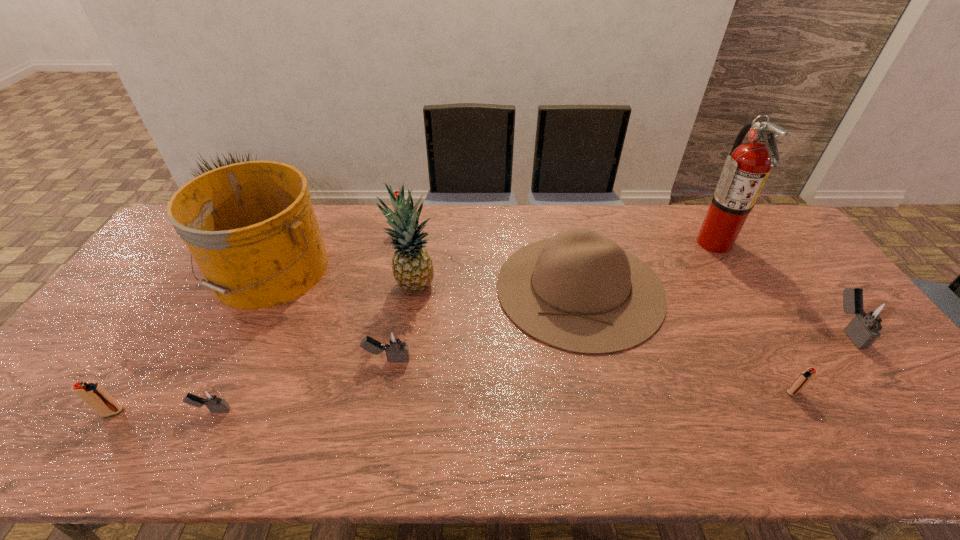
Where is `vacant space at the far right corner of the desktop`? vacant space at the far right corner of the desktop is located at coordinates (758, 217).

Identify the location of free space between the pineapple and the bucket. Image resolution: width=960 pixels, height=540 pixels. (341, 278).

The image size is (960, 540). In order to click on vacant space that's between the leftmost gray igniter and the fourth farthest igniter in this screenshot , I will do tap(502, 401).

At what (x,y) coordinates should I click in order to perform the action: click on free space between the rightmost gray igniter and the nearest red igniter. Please return your answer as a coordinate pair (x, y). This screenshot has width=960, height=540. Looking at the image, I should click on (480, 370).

Find the location of a particular element. This screenshot has height=540, width=960. empty space between the smallest gray igniter and the pineapple is located at coordinates (313, 348).

Where is `unoccupied area between the leftmost red igniter and the red fire extinguisher`? The width and height of the screenshot is (960, 540). unoccupied area between the leftmost red igniter and the red fire extinguisher is located at coordinates pos(413,327).

At what (x,y) coordinates should I click in order to perform the action: click on vacant space that is in between the leftmost igniter and the second red igniter from left to right. Please return your answer as a coordinate pair (x, y). Looking at the image, I should click on (258, 321).

Where is `empty space that is in between the leftmost igniter and the ninth shortest object`? empty space that is in between the leftmost igniter and the ninth shortest object is located at coordinates (263, 349).

Select which object appears as the eighth closest to the second smallest red igniter. Please provide its 2D coordinates. Your answer should be formatted as a tuple, i.e. [(x, y)], where the tuple contains the x and y coordinates of a point satisfying the conditions above.

[(746, 169)]

Identify which object is the third closest to the brown sombrero. Please provide its 2D coordinates. Your answer should be formatted as a tuple, i.e. [(x, y)], where the tuple contains the x and y coordinates of a point satisfying the conditions above.

[(809, 373)]